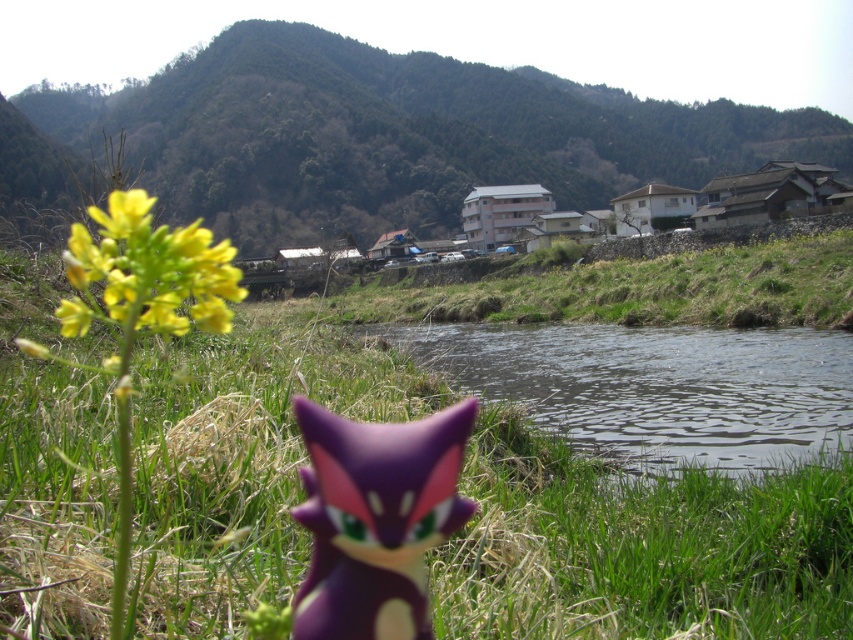
Can you confirm if green grass at center is thinner than green textured hillside at upper center?

Yes.

Locate an element on the screen. The height and width of the screenshot is (640, 853). green grass at center is located at coordinates (639, 547).

I want to click on green grass at center, so click(x=639, y=547).

Who is taller, green grass at center or yellow matte flower at left?

yellow matte flower at left

Can you confirm if green grass at center is shorter than yellow matte flower at left?

Yes, green grass at center is shorter than yellow matte flower at left.

Which is behind, point (13, 305) or point (67, 269)?

Point (67, 269)

At what (x,y) coordinates should I click in order to perform the action: click on green grass at center. Please return your answer as a coordinate pair (x, y). Looking at the image, I should click on (639, 547).

Which is below, purple matte toy at center or yellow matte flower at left?

purple matte toy at center is below.

Does purple matte toy at center have a smaller size compared to yellow matte flower at left?

Yes.

Where is `purple matte toy at center`? The width and height of the screenshot is (853, 640). purple matte toy at center is located at coordinates (375, 518).

I want to click on purple matte toy at center, so click(375, 518).